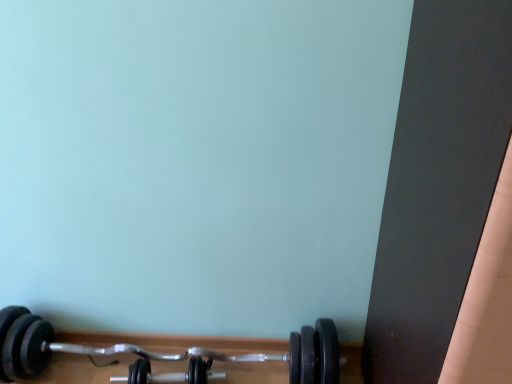
Question: Which direction should I rotate to look at black rubber dumbbell at lower center, the 1th dumbbell in the right-to-left sequence?

Choices:
 (A) right
 (B) left

Answer: (B)

Question: Can you confirm if black rubber dumbbell at lower center, the 2th dumbbell when ordered from left to right, is bigger than black rubber dumbbell at lower center, positioned as the second dumbbell in right-to-left order?

Choices:
 (A) no
 (B) yes

Answer: (A)

Question: Does black rubber dumbbell at lower center, the 2th dumbbell when ordered from left to right, have a greater width compared to black rubber dumbbell at lower center, positioned as the second dumbbell in right-to-left order?

Choices:
 (A) yes
 (B) no

Answer: (B)

Question: Does black rubber dumbbell at lower center, the 1th dumbbell in the right-to-left sequence, touch black rubber dumbbell at lower center, positioned as the second dumbbell in right-to-left order?

Choices:
 (A) no
 (B) yes

Answer: (A)

Question: From a real-world perspective, is black rubber dumbbell at lower center, the 2th dumbbell when ordered from left to right, on black rubber dumbbell at lower center, positioned as the second dumbbell in right-to-left order?

Choices:
 (A) yes
 (B) no

Answer: (B)

Question: Is black rubber dumbbell at lower center, the 1th dumbbell in the right-to-left sequence, positioned before black rubber dumbbell at lower center, positioned as the second dumbbell in right-to-left order?

Choices:
 (A) no
 (B) yes

Answer: (A)

Question: From a real-world perspective, is black rubber dumbbell at lower center, the 1th dumbbell in the right-to-left sequence, positioned under black rubber dumbbell at lower center, the 1th dumbbell positioned from the left, based on gravity?

Choices:
 (A) no
 (B) yes

Answer: (B)

Question: From a real-world perspective, does black rubber dumbbell at lower center, the 1th dumbbell positioned from the left, stand above black rubber dumbbell at lower center, the 1th dumbbell in the right-to-left sequence?

Choices:
 (A) yes
 (B) no

Answer: (A)

Question: From a real-world perspective, is black rubber dumbbell at lower center, positioned as the second dumbbell in right-to-left order, below black rubber dumbbell at lower center, the 2th dumbbell when ordered from left to right?

Choices:
 (A) no
 (B) yes

Answer: (A)

Question: From the image's perspective, would you say black rubber dumbbell at lower center, the 1th dumbbell positioned from the left, is positioned over black rubber dumbbell at lower center, the 1th dumbbell in the right-to-left sequence?

Choices:
 (A) no
 (B) yes

Answer: (B)

Question: Is black rubber dumbbell at lower center, positioned as the second dumbbell in right-to-left order, oriented away from black rubber dumbbell at lower center, the 2th dumbbell when ordered from left to right?

Choices:
 (A) yes
 (B) no

Answer: (A)

Question: Are black rubber dumbbell at lower center, positioned as the second dumbbell in right-to-left order, and black rubber dumbbell at lower center, the 2th dumbbell when ordered from left to right, making contact?

Choices:
 (A) yes
 (B) no

Answer: (B)

Question: Would you consider black rubber dumbbell at lower center, positioned as the second dumbbell in right-to-left order, to be distant from black rubber dumbbell at lower center, the 1th dumbbell in the right-to-left sequence?

Choices:
 (A) no
 (B) yes

Answer: (A)

Question: Considering the positions of black rubber dumbbell at lower center, positioned as the second dumbbell in right-to-left order, and black rubber dumbbell at lower center, the 2th dumbbell when ordered from left to right, in the image, is black rubber dumbbell at lower center, positioned as the second dumbbell in right-to-left order, wider or thinner than black rubber dumbbell at lower center, the 2th dumbbell when ordered from left to right,?

Choices:
 (A) wide
 (B) thin

Answer: (A)